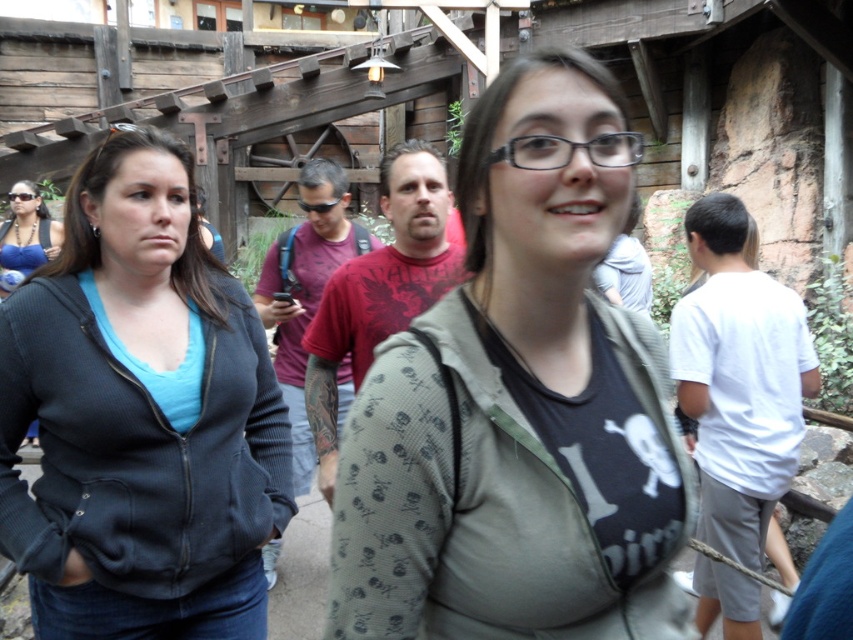
Question: Among these points, which one is farthest from the camera?

Choices:
 (A) (7, 256)
 (B) (793, 346)
 (C) (625, 205)

Answer: (A)

Question: Is matte black hoodie at center to the right of white cotton shirt at right from the viewer's perspective?

Choices:
 (A) yes
 (B) no

Answer: (B)

Question: Among these points, which one is farthest from the camera?

Choices:
 (A) pyautogui.click(x=790, y=410)
 (B) pyautogui.click(x=24, y=246)
 (C) pyautogui.click(x=181, y=394)

Answer: (B)

Question: Is matte olive green hoodie at center thinner than matte black hoodie at center?

Choices:
 (A) no
 (B) yes

Answer: (B)

Question: Does matte olive green hoodie at center have a smaller size compared to matte blue bikini top at upper left?

Choices:
 (A) no
 (B) yes

Answer: (B)

Question: Which point is closer to the camera taking this photo?

Choices:
 (A) (15, 333)
 (B) (16, 205)
 (C) (704, 532)

Answer: (A)